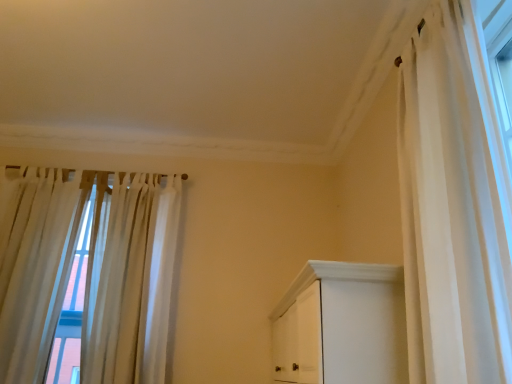
This screenshot has height=384, width=512. What do you see at coordinates (40, 269) in the screenshot? I see `white sheer curtain at left, the third curtain positioned from the right` at bounding box center [40, 269].

Identify the location of white sheer curtain at right, the 3th curtain viewed from the back. (450, 214).

The image size is (512, 384). What do you see at coordinates (450, 214) in the screenshot?
I see `white sheer curtain at right, the 1th curtain in the right-to-left sequence` at bounding box center [450, 214].

The height and width of the screenshot is (384, 512). Find the location of `white sheer curtain at left, the second curtain viewed from the back`. white sheer curtain at left, the second curtain viewed from the back is located at coordinates (40, 269).

Is sheer white curtains at left, acting as the 1th curtain starting from the back, oriented away from white sheer curtain at left, the 2th curtain positioned from the front?

Yes.

From a real-world perspective, who is located higher, sheer white curtains at left, acting as the second curtain starting from the left, or white sheer curtain at left, the second curtain viewed from the back?

In real-world perspective, sheer white curtains at left, acting as the second curtain starting from the left, is above.

From the image's perspective, is sheer white curtains at left, positioned as the 2th curtain in right-to-left order, above or below white sheer curtain at left, the second curtain viewed from the back?

Based on their image positions, sheer white curtains at left, positioned as the 2th curtain in right-to-left order, is located beneath white sheer curtain at left, the second curtain viewed from the back.

From the image's perspective, is white sheer curtain at right, which is the 1th curtain from front to back, over sheer white curtains at left, positioned as the 2th curtain in right-to-left order?

Indeed, from the image's perspective, white sheer curtain at right, which is the 1th curtain from front to back, is shown above sheer white curtains at left, positioned as the 2th curtain in right-to-left order.

From a real-world perspective, is white sheer curtain at right, which is counted as the third curtain, starting from the left, on top of sheer white curtains at left, acting as the 1th curtain starting from the back?

Yes, from a real-world perspective, white sheer curtain at right, which is counted as the third curtain, starting from the left, is on top of sheer white curtains at left, acting as the 1th curtain starting from the back.

Would you consider white sheer curtain at right, the 1th curtain in the right-to-left sequence, to be distant from sheer white curtains at left, acting as the 1th curtain starting from the back?

Yes, white sheer curtain at right, the 1th curtain in the right-to-left sequence, and sheer white curtains at left, acting as the 1th curtain starting from the back, are located far from each other.

Is sheer white curtains at left, acting as the second curtain starting from the left, taller than white sheer curtain at right, the 3th curtain viewed from the back?

Indeed, sheer white curtains at left, acting as the second curtain starting from the left, has a greater height compared to white sheer curtain at right, the 3th curtain viewed from the back.

In the scene shown: Which is more to the left, sheer white curtains at left, acting as the 1th curtain starting from the back, or white sheer curtain at right, the 1th curtain in the right-to-left sequence?

Positioned to the left is sheer white curtains at left, acting as the 1th curtain starting from the back.

Relative to white sheer curtain at right, which is the 1th curtain from front to back, is sheer white curtains at left, which is the 3th curtain from front to back, in front or behind?

sheer white curtains at left, which is the 3th curtain from front to back, is positioned farther from the viewer than white sheer curtain at right, which is the 1th curtain from front to back.

From the image's perspective, which object appears higher, sheer white curtains at left, positioned as the 2th curtain in right-to-left order, or white sheer curtain at right, the 1th curtain in the right-to-left sequence?

white sheer curtain at right, the 1th curtain in the right-to-left sequence, appears higher in the image.

Is white sheer curtain at right, the 1th curtain in the right-to-left sequence, not inside white sheer curtain at left, which ranks as the 1th curtain in left-to-right order?

Yes, white sheer curtain at right, the 1th curtain in the right-to-left sequence, is located beyond the bounds of white sheer curtain at left, which ranks as the 1th curtain in left-to-right order.

From a real-world perspective, is white sheer curtain at right, which is counted as the third curtain, starting from the left, positioned above or below white sheer curtain at left, the third curtain positioned from the right?

white sheer curtain at right, which is counted as the third curtain, starting from the left, is situated higher than white sheer curtain at left, the third curtain positioned from the right, in the real world.

Does white sheer curtain at right, the 1th curtain in the right-to-left sequence, have a larger size compared to white sheer curtain at left, the second curtain viewed from the back?

No, white sheer curtain at right, the 1th curtain in the right-to-left sequence, is not bigger than white sheer curtain at left, the second curtain viewed from the back.

From a real-world perspective, is white sheer curtain at left, which ranks as the 1th curtain in left-to-right order, positioned under white sheer curtain at right, which is counted as the third curtain, starting from the left, based on gravity?

Yes.

Considering the relative sizes of white sheer curtain at left, the third curtain positioned from the right, and white sheer curtain at right, which is counted as the third curtain, starting from the left, in the image provided, is white sheer curtain at left, the third curtain positioned from the right, shorter than white sheer curtain at right, which is counted as the third curtain, starting from the left,?

In fact, white sheer curtain at left, the third curtain positioned from the right, may be taller than white sheer curtain at right, which is counted as the third curtain, starting from the left.

Is white sheer curtain at left, the 2th curtain positioned from the front, turned away from white sheer curtain at right, the 1th curtain in the right-to-left sequence?

No, white sheer curtain at left, the 2th curtain positioned from the front, is not facing the opposite direction of white sheer curtain at right, the 1th curtain in the right-to-left sequence.

In the scene shown: From the image's perspective, is white sheer curtain at left, the 2th curtain positioned from the front, above sheer white curtains at left, acting as the 1th curtain starting from the back?

Yes.

Does white sheer curtain at left, which ranks as the 1th curtain in left-to-right order, lie in front of sheer white curtains at left, acting as the second curtain starting from the left?

Yes, it is in front of sheer white curtains at left, acting as the second curtain starting from the left.

Does white sheer curtain at left, which ranks as the 1th curtain in left-to-right order, touch sheer white curtains at left, positioned as the 2th curtain in right-to-left order?

No, white sheer curtain at left, which ranks as the 1th curtain in left-to-right order, is not making contact with sheer white curtains at left, positioned as the 2th curtain in right-to-left order.

Can you confirm if white sheer curtain at left, the second curtain viewed from the back, is positioned to the left of sheer white curtains at left, acting as the 1th curtain starting from the back?

Indeed, white sheer curtain at left, the second curtain viewed from the back, is positioned on the left side of sheer white curtains at left, acting as the 1th curtain starting from the back.

Image resolution: width=512 pixels, height=384 pixels. Identify the location of curtain below the white sheer curtain at left, which ranks as the 1th curtain in left-to-right order (from the image's perspective). point(88,271).

I want to click on curtain that appears on the right of sheer white curtains at left, which is the 3th curtain from front to back, so click(x=450, y=214).

From the image, which object appears to be nearer to sheer white curtains at left, which is the 3th curtain from front to back, white sheer curtain at right, which is counted as the third curtain, starting from the left, or white sheer curtain at left, the third curtain positioned from the right?

Among the two, white sheer curtain at left, the third curtain positioned from the right, is located nearer to sheer white curtains at left, which is the 3th curtain from front to back.

From the image, which object appears to be nearer to white sheer curtain at right, which is the 1th curtain from front to back, white sheer curtain at left, the second curtain viewed from the back, or sheer white curtains at left, acting as the second curtain starting from the left?

sheer white curtains at left, acting as the second curtain starting from the left, is positioned closer to the anchor white sheer curtain at right, which is the 1th curtain from front to back.

Looking at this image, estimate the real-world distances between objects in this image. Which object is further from sheer white curtains at left, acting as the 1th curtain starting from the back, white sheer curtain at left, which ranks as the 1th curtain in left-to-right order, or white sheer curtain at right, which is counted as the third curtain, starting from the left?

Among the two, white sheer curtain at right, which is counted as the third curtain, starting from the left, is located further to sheer white curtains at left, acting as the 1th curtain starting from the back.

Considering their positions, is sheer white curtains at left, acting as the second curtain starting from the left, positioned further to white sheer curtain at right, the 1th curtain in the right-to-left sequence, than white sheer curtain at left, the second curtain viewed from the back?

white sheer curtain at left, the second curtain viewed from the back, is positioned further to the anchor white sheer curtain at right, the 1th curtain in the right-to-left sequence.

Which object lies further to the anchor point white sheer curtain at left, the second curtain viewed from the back, sheer white curtains at left, acting as the second curtain starting from the left, or white sheer curtain at right, the 3th curtain viewed from the back?

The object further to white sheer curtain at left, the second curtain viewed from the back, is white sheer curtain at right, the 3th curtain viewed from the back.

Considering their positions, is white sheer curtain at right, which is counted as the third curtain, starting from the left, positioned closer to white sheer curtain at left, the second curtain viewed from the back, than sheer white curtains at left, acting as the second curtain starting from the left?

sheer white curtains at left, acting as the second curtain starting from the left.

Identify the location of curtain between white sheer curtain at left, the third curtain positioned from the right, and white sheer curtain at right, which is the 1th curtain from front to back, from left to right. coord(88,271).